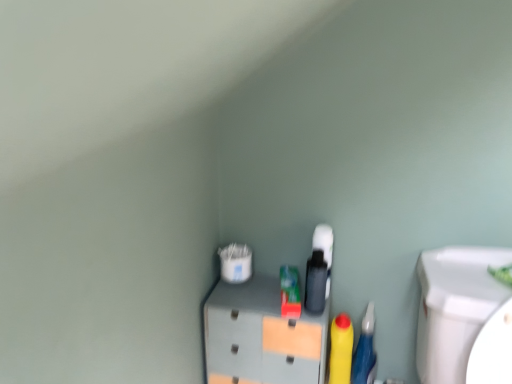
Describe the element at coordinates (341, 350) in the screenshot. I see `yellow matte bottle at center` at that location.

Measure the distance between rubberized blue pen at right and camera.

A distance of 1.13 meters exists between rubberized blue pen at right and camera.

Locate an element on the screen. The width and height of the screenshot is (512, 384). yellow matte bottle at center is located at coordinates (341, 350).

Are matte gray cabinet at center and yellow matte bottle at center located far from each other?

Actually, matte gray cabinet at center and yellow matte bottle at center are a little close together.

Does point (302, 351) come behind point (341, 324)?

No, it is not.

Looking at the image, does matte gray cabinet at center seem bigger or smaller compared to yellow matte bottle at center?

Considering their sizes, matte gray cabinet at center takes up more space than yellow matte bottle at center.

Which object is more forward, yellow matte bottle at center or matte gray cabinet at center?

matte gray cabinet at center is in front.

From a real-world perspective, is yellow matte bottle at center over matte gray cabinet at center?

No, from a real-world perspective, yellow matte bottle at center is not over matte gray cabinet at center

From the picture: Could you tell me if yellow matte bottle at center is facing matte gray cabinet at center?

No.

Can you confirm if yellow matte bottle at center is positioned to the left of matte gray cabinet at center?

No.

Is rubberized blue pen at right to the right of yellow matte bottle at center from the viewer's perspective?

Yes.

From a real-world perspective, is rubberized blue pen at right physically above yellow matte bottle at center?

No, from a real-world perspective, rubberized blue pen at right is not above yellow matte bottle at center.

Is rubberized blue pen at right not inside yellow matte bottle at center?

That's correct, rubberized blue pen at right is outside of yellow matte bottle at center.

Considering the relative positions of yellow matte bottle at center and rubberized blue pen at right in the image provided, is yellow matte bottle at center to the left of rubberized blue pen at right from the viewer's perspective?

Indeed, yellow matte bottle at center is positioned on the left side of rubberized blue pen at right.

Considering the relative sizes of yellow matte bottle at center and rubberized blue pen at right in the image provided, is yellow matte bottle at center taller than rubberized blue pen at right?

No, yellow matte bottle at center is not taller than rubberized blue pen at right.

Which is behind, yellow matte bottle at center or rubberized blue pen at right?

Positioned behind is yellow matte bottle at center.

Could you tell me if yellow matte bottle at center is facing rubberized blue pen at right?

No.

How much distance is there between rubberized blue pen at right and matte gray cabinet at center?

They are 10.36 inches apart.

From a real-world perspective, is rubberized blue pen at right positioned over matte gray cabinet at center based on gravity?

No, from a real-world perspective, rubberized blue pen at right is not on top of matte gray cabinet at center.

Is rubberized blue pen at right oriented towards matte gray cabinet at center?

No, rubberized blue pen at right is not facing towards matte gray cabinet at center.

From the image's perspective, is rubberized blue pen at right above or below matte gray cabinet at center?

Based on their image positions, rubberized blue pen at right is located beneath matte gray cabinet at center.

Who is smaller, matte gray cabinet at center or rubberized blue pen at right?

With smaller size is rubberized blue pen at right.

Considering the positions of objects matte gray cabinet at center and rubberized blue pen at right in the image provided, who is more to the right, matte gray cabinet at center or rubberized blue pen at right?

rubberized blue pen at right.

Is matte gray cabinet at center turned away from rubberized blue pen at right?

matte gray cabinet at center is not turned away from rubberized blue pen at right.

Considering the relative sizes of matte gray cabinet at center and rubberized blue pen at right in the image provided, is matte gray cabinet at center wider than rubberized blue pen at right?

Yes.

Where is `furniture in front of the yellow matte bottle at center`? This screenshot has height=384, width=512. furniture in front of the yellow matte bottle at center is located at coordinates (261, 336).

Where is `furniture above the yellow matte bottle at center (from the image's perspective)`? Image resolution: width=512 pixels, height=384 pixels. furniture above the yellow matte bottle at center (from the image's perspective) is located at coordinates (261, 336).

From the image, which object appears to be nearer to matte gray cabinet at center, rubberized blue pen at right or yellow matte bottle at center?

yellow matte bottle at center is closer to matte gray cabinet at center.

Which object lies further to the anchor point rubberized blue pen at right, matte gray cabinet at center or yellow matte bottle at center?

matte gray cabinet at center is positioned further to the anchor rubberized blue pen at right.

From the picture: Looking at the image, which one is located further to rubberized blue pen at right, yellow matte bottle at center or matte gray cabinet at center?

matte gray cabinet at center lies further to rubberized blue pen at right than the other object.

Considering their positions, is matte gray cabinet at center positioned further to yellow matte bottle at center than rubberized blue pen at right?

matte gray cabinet at center is further to yellow matte bottle at center.

Based on their spatial positions, is yellow matte bottle at center or rubberized blue pen at right closer to matte gray cabinet at center?

yellow matte bottle at center is closer to matte gray cabinet at center.

From the image, which object appears to be farther from yellow matte bottle at center, rubberized blue pen at right or matte gray cabinet at center?

Among the two, matte gray cabinet at center is located further to yellow matte bottle at center.

Where is `cleaning product between matte gray cabinet at center and rubberized blue pen at right in the horizontal direction`? cleaning product between matte gray cabinet at center and rubberized blue pen at right in the horizontal direction is located at coordinates (341, 350).